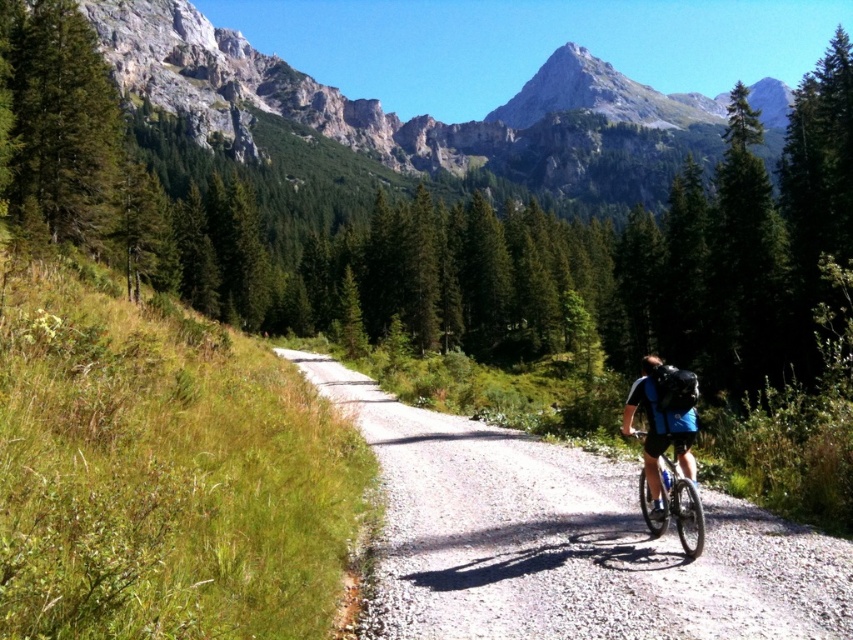
Question: Does blue matte mountain bike at center lie behind matte black helmet at center?

Choices:
 (A) yes
 (B) no

Answer: (B)

Question: Considering the real-world distances, which object is farthest from the gravel road at center?

Choices:
 (A) blue matte mountain bike at center
 (B) matte black helmet at center

Answer: (B)

Question: Does rugged stone mountain at upper center have a lesser width compared to matte black helmet at center?

Choices:
 (A) yes
 (B) no

Answer: (B)

Question: Considering the real-world distances, which object is farthest from the rugged stone mountain at upper center?

Choices:
 (A) blue matte mountain bike at center
 (B) gravel road at center

Answer: (A)

Question: Which object appears farthest from the camera in this image?

Choices:
 (A) gravel road at center
 (B) rugged stone mountain at upper center

Answer: (B)

Question: Is blue matte mountain bike at center further to the viewer compared to matte black helmet at center?

Choices:
 (A) no
 (B) yes

Answer: (A)